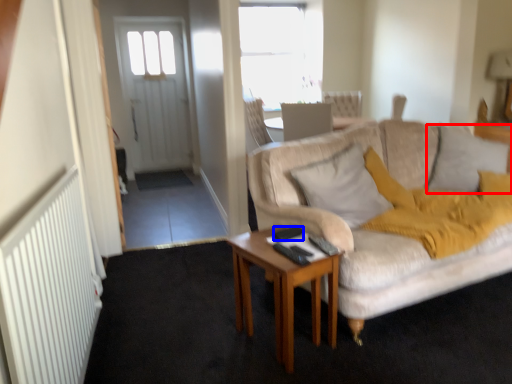
Question: Which point is further to the camera, pillow (highlighted by a red box) or remote control (highlighted by a blue box)?

Choices:
 (A) pillow
 (B) remote control

Answer: (A)